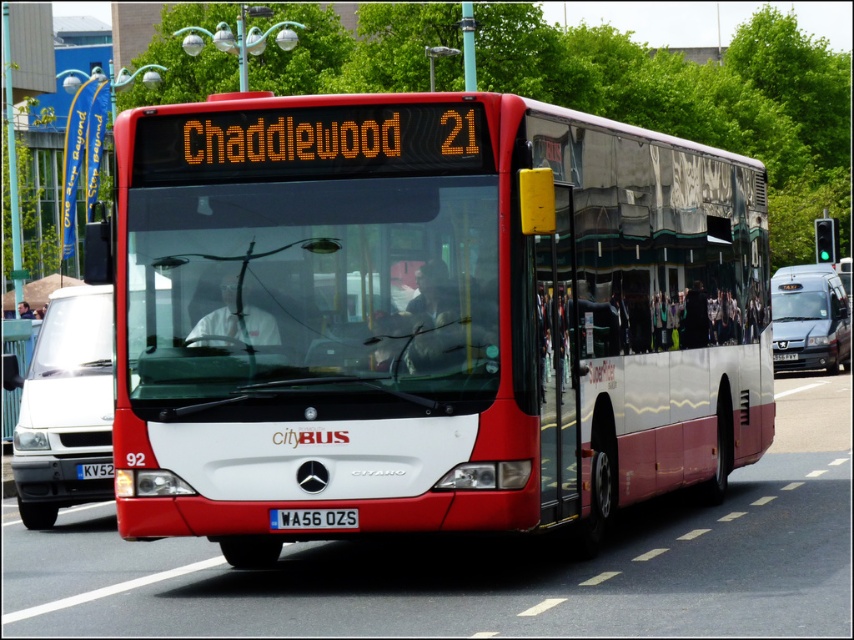
Between point (793, 355) and point (268, 525), which one is positioned in front?

Point (268, 525)

The height and width of the screenshot is (640, 854). I want to click on metallic silver van at center, so click(x=809, y=320).

Does shiny red bus at center come behind white matte van at left?

No, it is not.

Who is positioned more to the left, shiny red bus at center or white matte van at left?

Positioned to the left is white matte van at left.

Between point (494, 464) and point (91, 388), which one is positioned in front?

Point (494, 464) is in front.

Image resolution: width=854 pixels, height=640 pixels. In order to click on shiny red bus at center in this screenshot , I will do `click(427, 316)`.

Between white matte van at left and white metallic license plate at center, which one has less height?

white metallic license plate at center

Is white matte van at left in front of white metallic license plate at center?

No, white matte van at left is further to the viewer.

Does point (110, 348) lie behind point (300, 518)?

Yes, it is behind point (300, 518).

You are a GUI agent. You are given a task and a screenshot of the screen. Output one action in this format:
    pyautogui.click(x=<x>, y=<y>)
    Task: Click on the white matte van at left
    This screenshot has height=640, width=854.
    Given the screenshot: What is the action you would take?
    pyautogui.click(x=65, y=406)